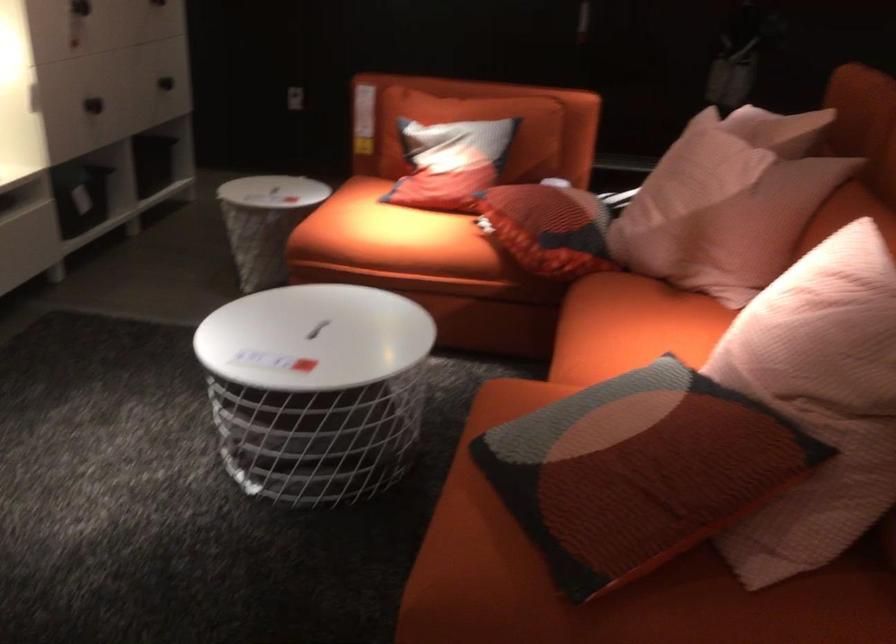
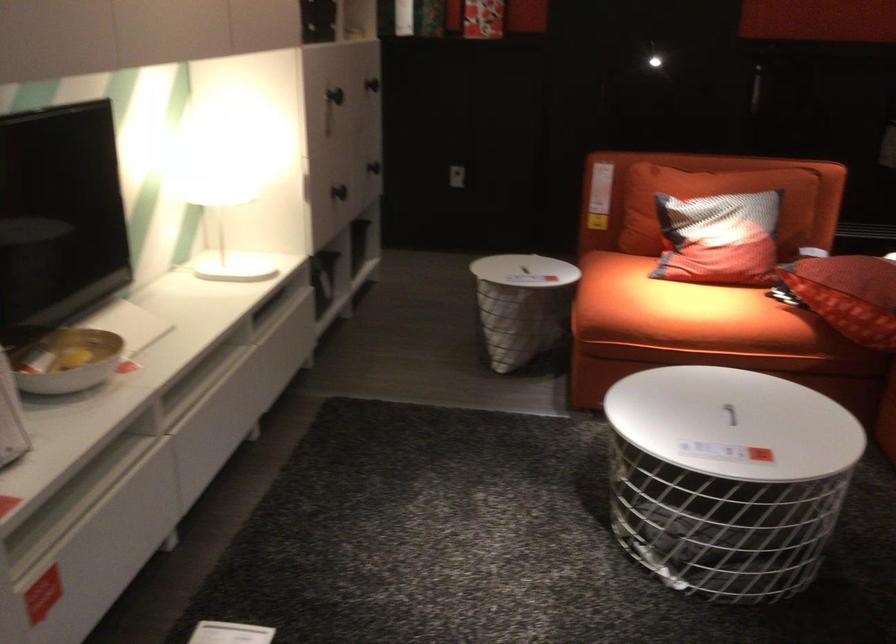
The point at (161, 80) is marked in the first image. Where is the corresponding point in the second image?

(373, 167)